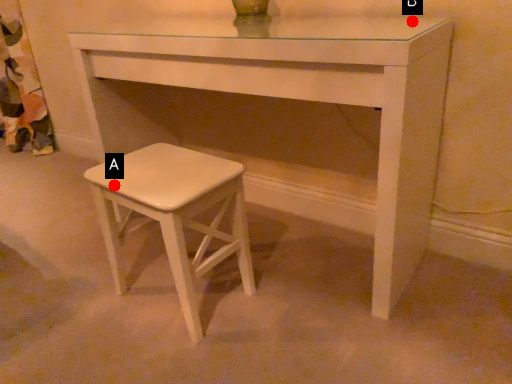
Question: Two points are circled on the image, labeled by A and B beside each circle. Among these points, which one is farthest from the camera?

Choices:
 (A) A is further
 (B) B is further

Answer: (B)